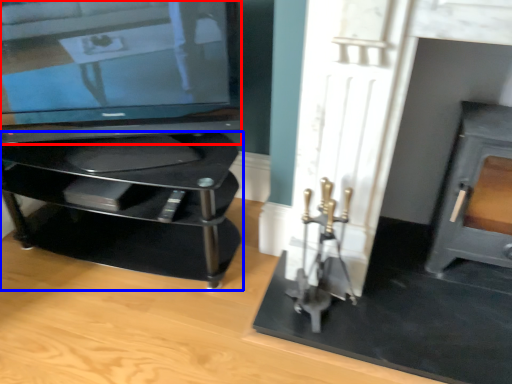
Question: Which point is closer to the camera, television (highlighted by a red box) or furniture (highlighted by a blue box)?

Choices:
 (A) television
 (B) furniture

Answer: (A)